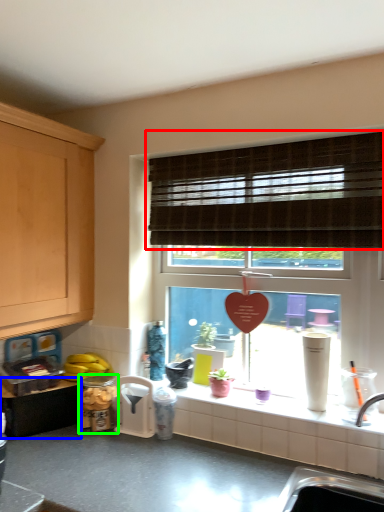
Question: Considering the real-world distances, which object is closest to window blind (highlighted by a red box)? cabinetry (highlighted by a blue box) or appliance (highlighted by a green box).

Choices:
 (A) cabinetry
 (B) appliance

Answer: (B)